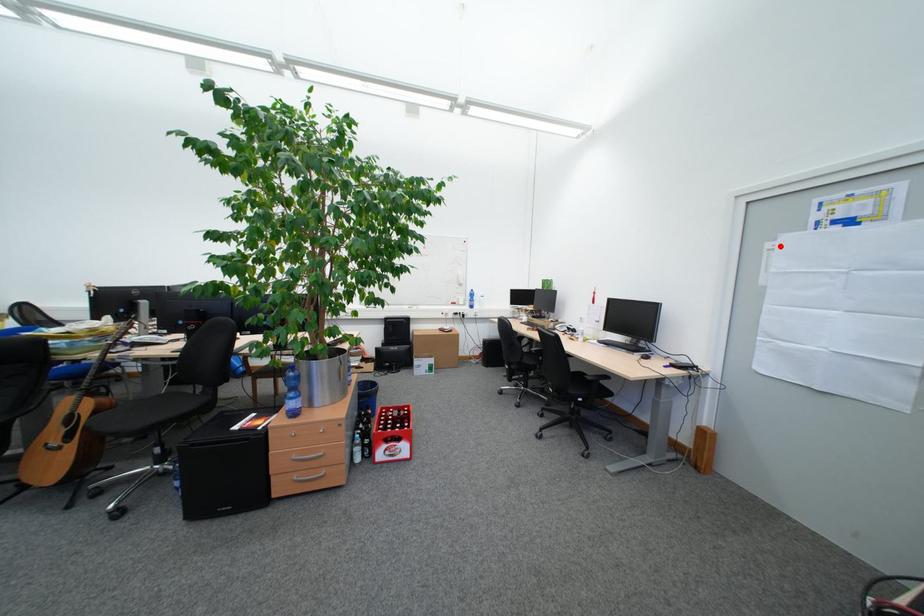
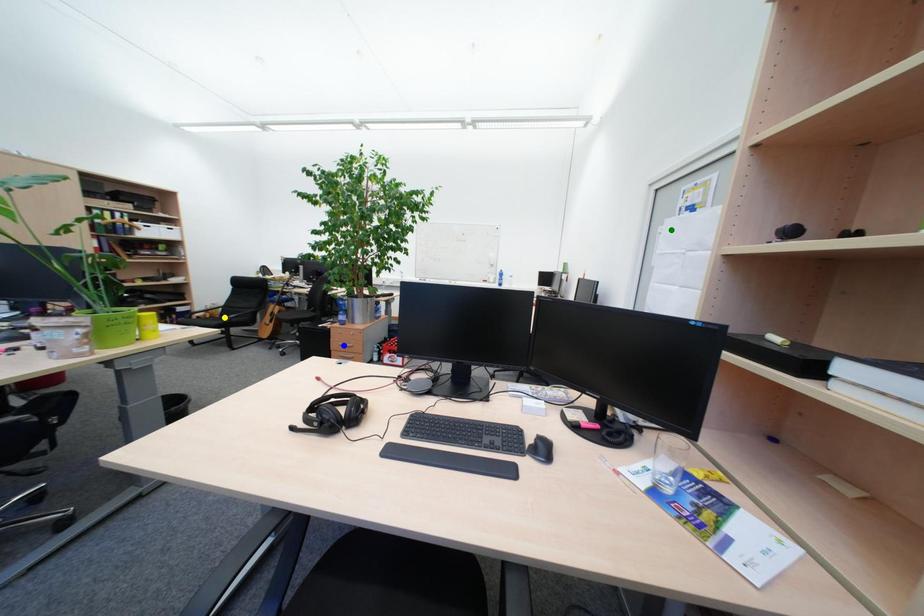
Question: I am providing you with two images of the same scene from different viewpoints. A red point is marked on the first image. You are given multiple points on the second image. Which mark in image 2 goes with the point in image 1?

Choices:
 (A) blue point
 (B) yellow point
 (C) green point

Answer: (C)